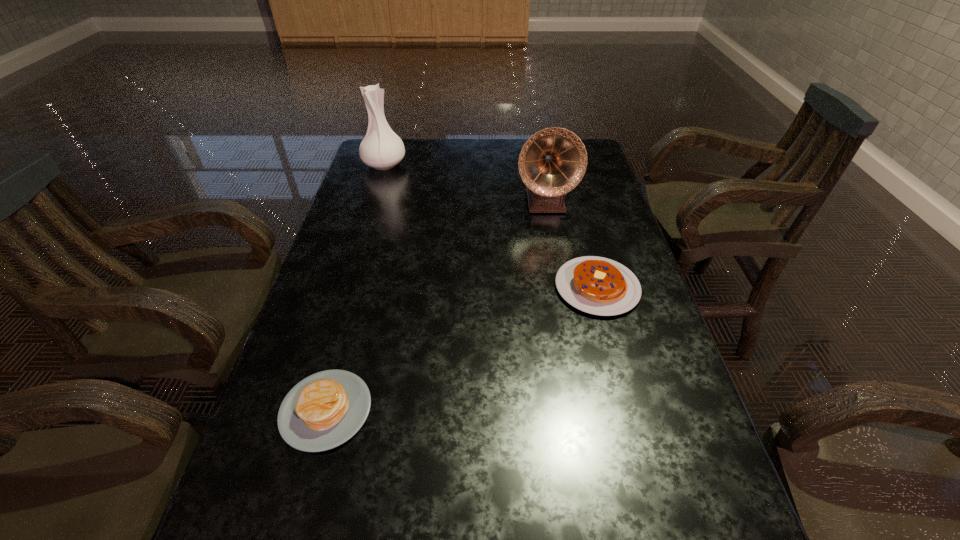
You are a GUI agent. You are given a task and a screenshot of the screen. Output one action in this format:
    pyautogui.click(x=<x>, y=<y>)
    Task: Click on the object that is at the far edge
    
    Given the screenshot: What is the action you would take?
    pyautogui.click(x=381, y=148)

Identify the location of vase situated at the left edge. (381, 148).

Identify the location of pancake that is at the left edge. 324,410.

Locate an element on the screen. phonograph record that is at the right edge is located at coordinates (552, 162).

The height and width of the screenshot is (540, 960). I want to click on pancake that is at the right edge, so click(x=600, y=286).

Where is `object positioned at the far left corner`? The height and width of the screenshot is (540, 960). object positioned at the far left corner is located at coordinates (381, 148).

In the image, there is a desktop. Where is `free space at the far edge`? free space at the far edge is located at coordinates (429, 144).

Identify the location of vacant space at the left edge of the desktop. (372, 184).

Find the location of a particular element. vacant area at the right edge of the desktop is located at coordinates (599, 210).

Find the location of a particular element. The image size is (960, 540). empty location between the vase and the right pancake is located at coordinates (491, 226).